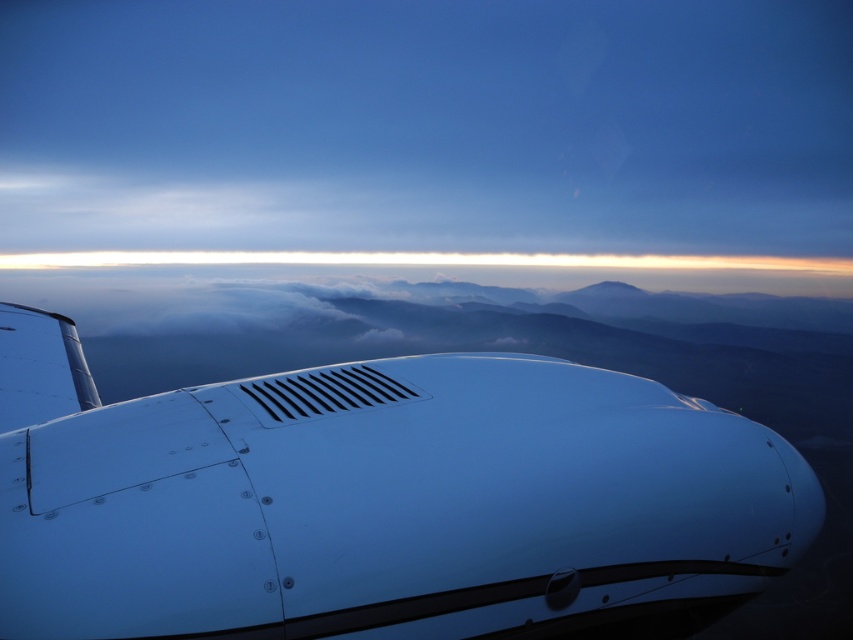
Does metallic blue airplane at lower left have a lesser width compared to metallic vent at center?

In fact, metallic blue airplane at lower left might be wider than metallic vent at center.

Is point (389, 602) farther from viewer compared to point (399, 401)?

No, (389, 602) is closer to viewer.

Image resolution: width=853 pixels, height=640 pixels. Describe the element at coordinates (381, 504) in the screenshot. I see `metallic blue airplane at lower left` at that location.

Find the location of `metallic blue airplane at lower left`. metallic blue airplane at lower left is located at coordinates (381, 504).